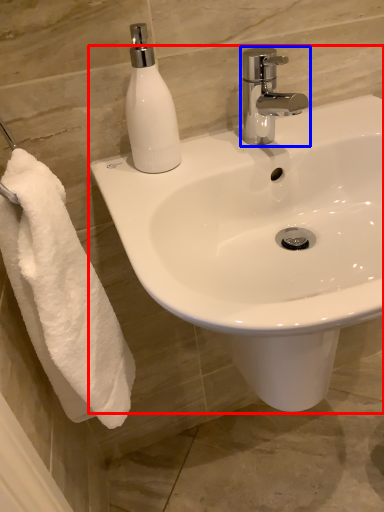
Question: Which of the following is the farthest to the observer, sink (highlighted by a red box) or tap (highlighted by a blue box)?

Choices:
 (A) sink
 (B) tap

Answer: (B)